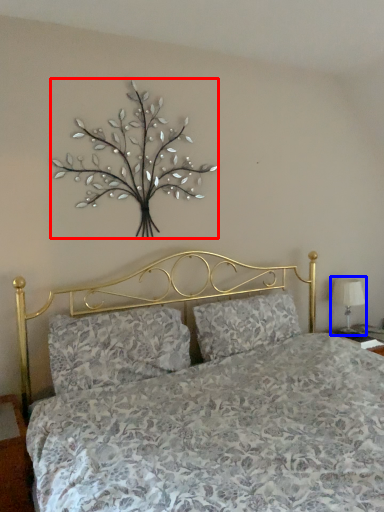
Question: Which object is closer to the camera taking this photo, floral arrangement (highlighted by a red box) or table lamp (highlighted by a blue box)?

Choices:
 (A) floral arrangement
 (B) table lamp

Answer: (A)